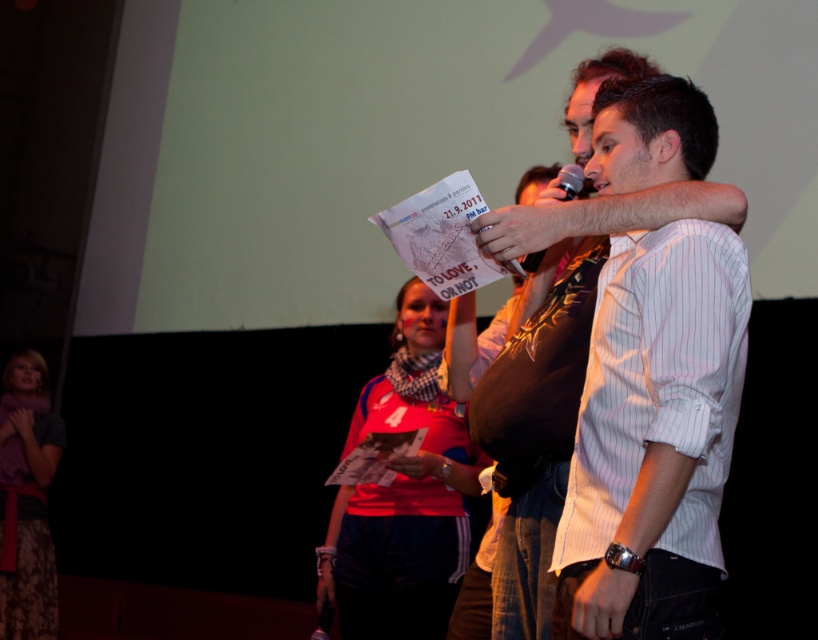
Is matte pink shirt at center taller than metallic silver microphone at upper center?

Yes, matte pink shirt at center is taller than metallic silver microphone at upper center.

Between matte pink shirt at center and metallic silver microphone at upper center, which one is positioned higher?

Positioned higher is metallic silver microphone at upper center.

Does point (351, 540) lie behind point (524, 266)?

Yes, point (351, 540) is farther from viewer.

Find the location of `matte pink shirt at center`. matte pink shirt at center is located at coordinates (403, 496).

This screenshot has height=640, width=818. Describe the element at coordinates (649, 132) in the screenshot. I see `white striped shirt at center` at that location.

Which is below, white striped shirt at center or matte pink shirt at center?

matte pink shirt at center is lower down.

Measure the distance between point (673, 628) and camera.

Point (673, 628) and camera are 3.71 feet apart.

This screenshot has width=818, height=640. Identify the location of white striped shirt at center. (649, 132).

From the picture: Does matte pink shirt at center come in front of velvet purple scarf at lower left?

That is True.

Which is more to the right, matte pink shirt at center or velvet purple scarf at lower left?

Positioned to the right is matte pink shirt at center.

Which is in front, point (425, 404) or point (25, 412)?

Point (425, 404) is in front.

Locate an element on the screen. The width and height of the screenshot is (818, 640). matte pink shirt at center is located at coordinates (403, 496).